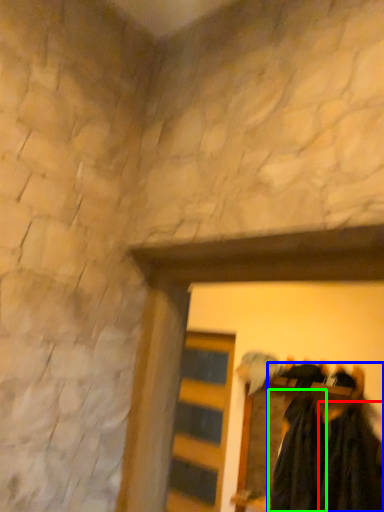
Question: Estimate the real-world distances between objects in this image. Which object is closer to clothing (highlighted by a red box), laundry (highlighted by a blue box) or clothing (highlighted by a green box)?

Choices:
 (A) laundry
 (B) clothing

Answer: (A)